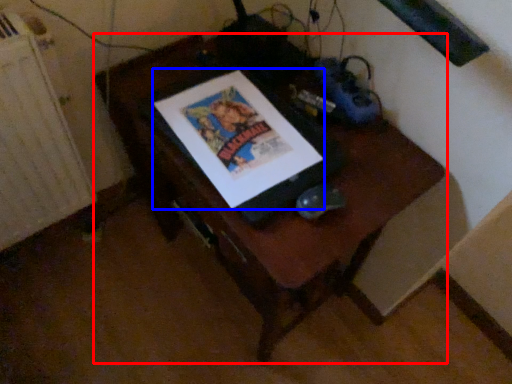
Question: Among these objects, which one is nearest to the camera, furniture (highlighted by a red box) or comic book (highlighted by a blue box)?

Choices:
 (A) furniture
 (B) comic book

Answer: (A)